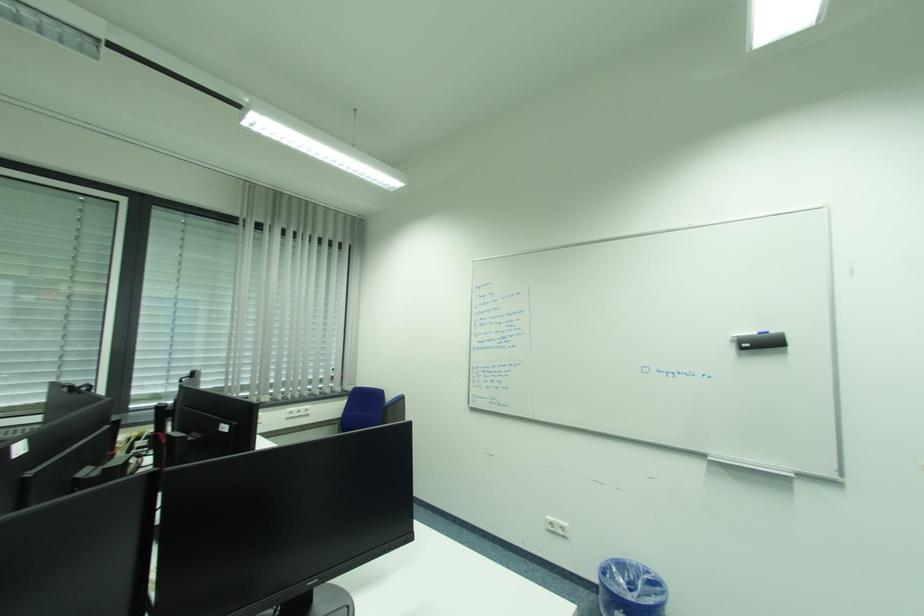
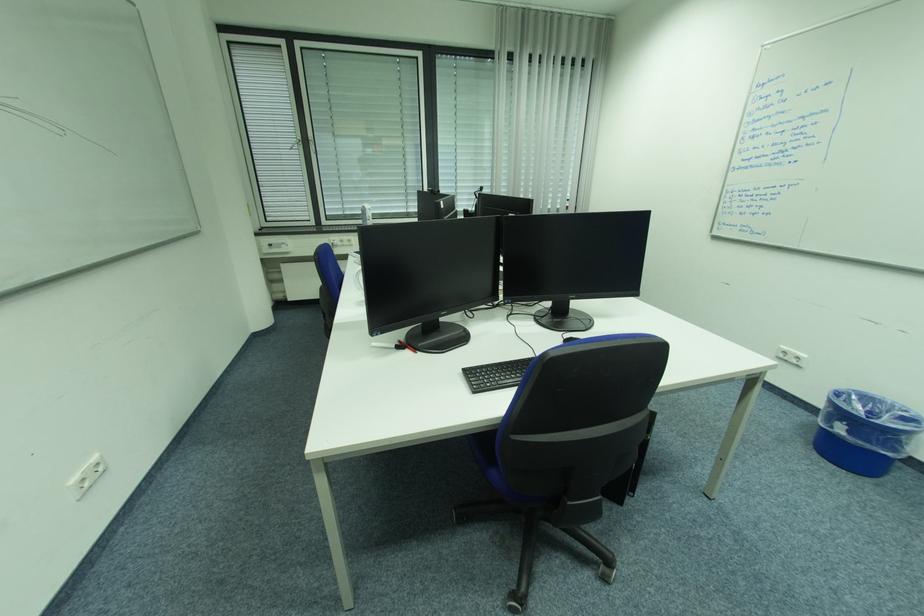
The first image is from the beginning of the video and the second image is from the end. How did the camera likely rotate when shooting the video?

The rotation direction of the camera is left-down.